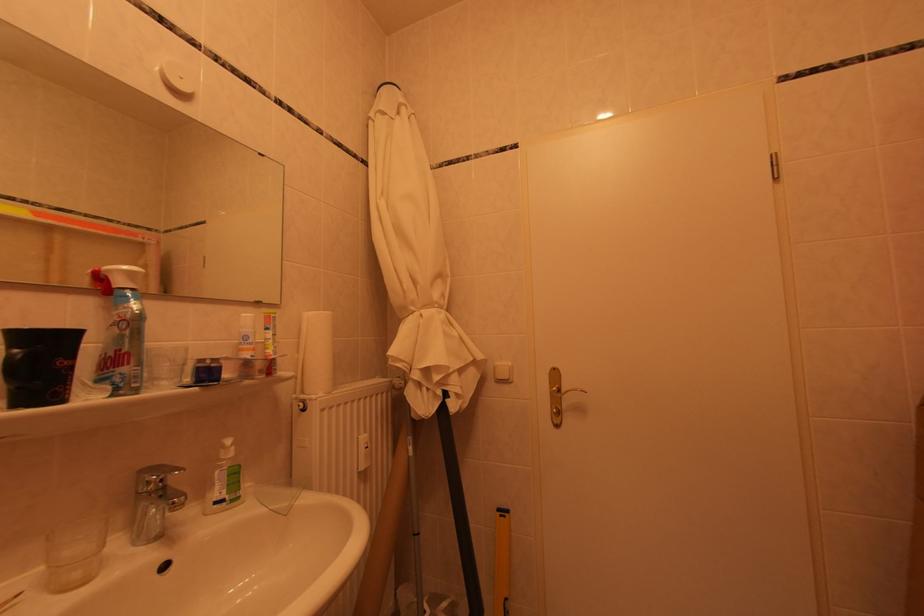
The height and width of the screenshot is (616, 924). What are the coordinates of `spray bottle trigger` in the screenshot? It's located at (111, 379).